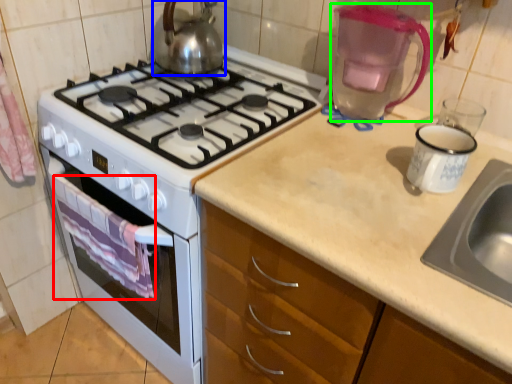
Question: Which is nearer to the cloth (highlighted by a red box)? kettle (highlighted by a blue box) or coffeepot (highlighted by a green box).

Choices:
 (A) kettle
 (B) coffeepot

Answer: (A)